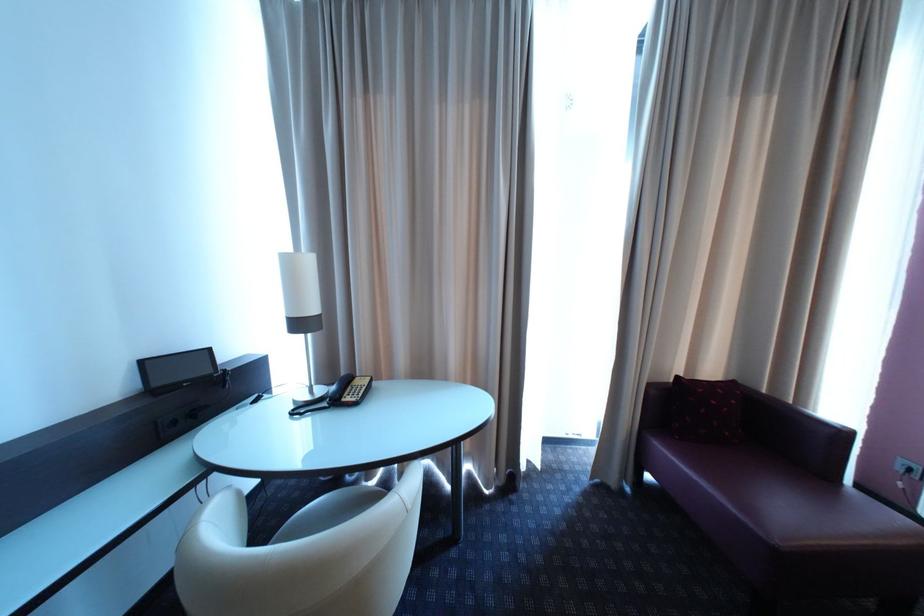
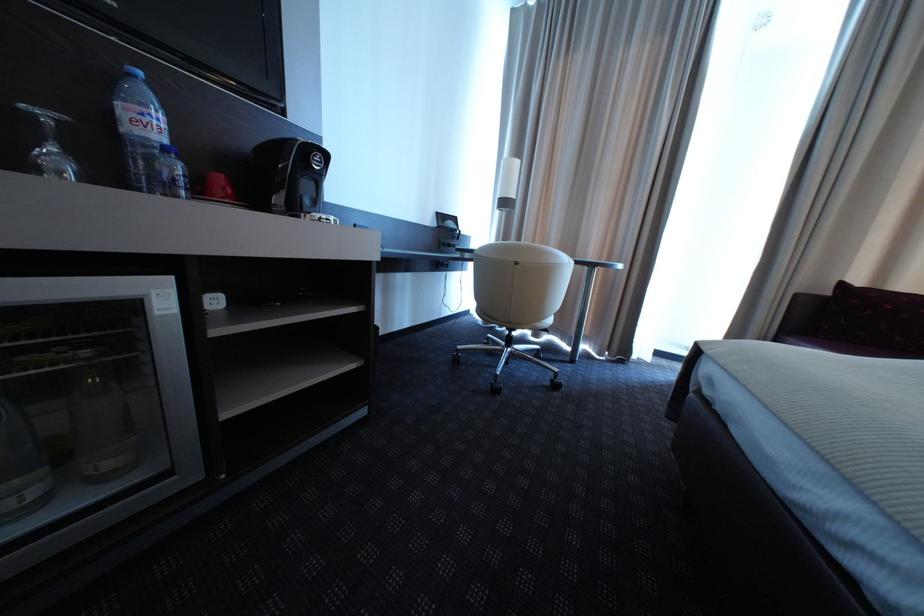
Question: The images are taken continuously from a first-person perspective. In which direction are you moving?

Choices:
 (A) Left
 (B) Right
 (C) Forward
 (D) Backward

Answer: (D)